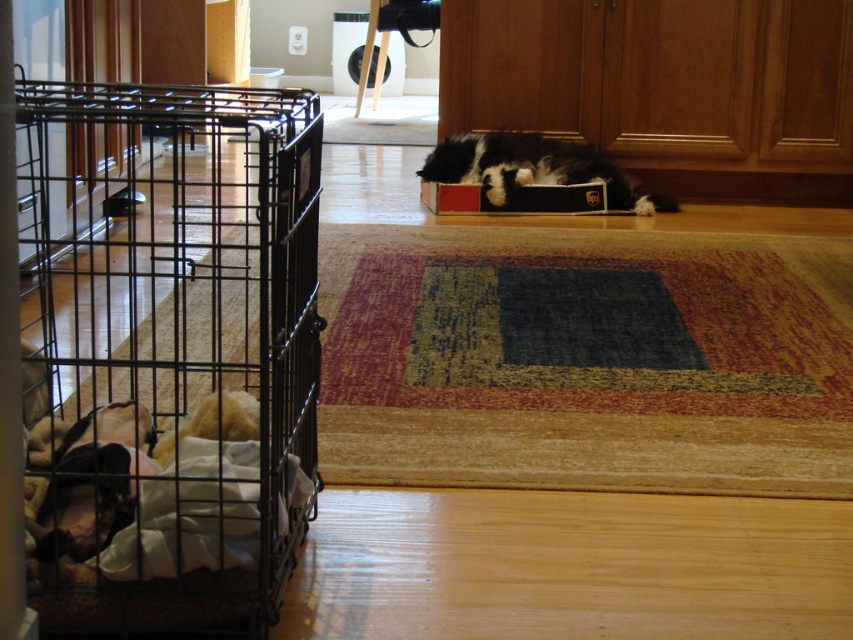
Who is taller, black and white fur cat at center or red cardboard box at center?

black and white fur cat at center is taller.

Which is behind, point (476, 140) or point (544, 188)?

The point (476, 140) is more distant.

Where is `black and white fur cat at center`? The image size is (853, 640). black and white fur cat at center is located at coordinates (532, 168).

Can you confirm if black wire cage at left is bigger than black and white fur cat at center?

Yes.

Describe the element at coordinates (166, 352) in the screenshot. I see `black wire cage at left` at that location.

Locate an element on the screen. The image size is (853, 640). black wire cage at left is located at coordinates (166, 352).

Is point (120, 492) less distant than point (601, 195)?

Yes, point (120, 492) is closer to viewer.

Which is below, black wire cage at left or red cardboard box at center?

Positioned lower is black wire cage at left.

Measure the distance between black wire cage at left and camera.

black wire cage at left and camera are 1.41 meters apart from each other.

Where is `black wire cage at left`? The width and height of the screenshot is (853, 640). black wire cage at left is located at coordinates (166, 352).